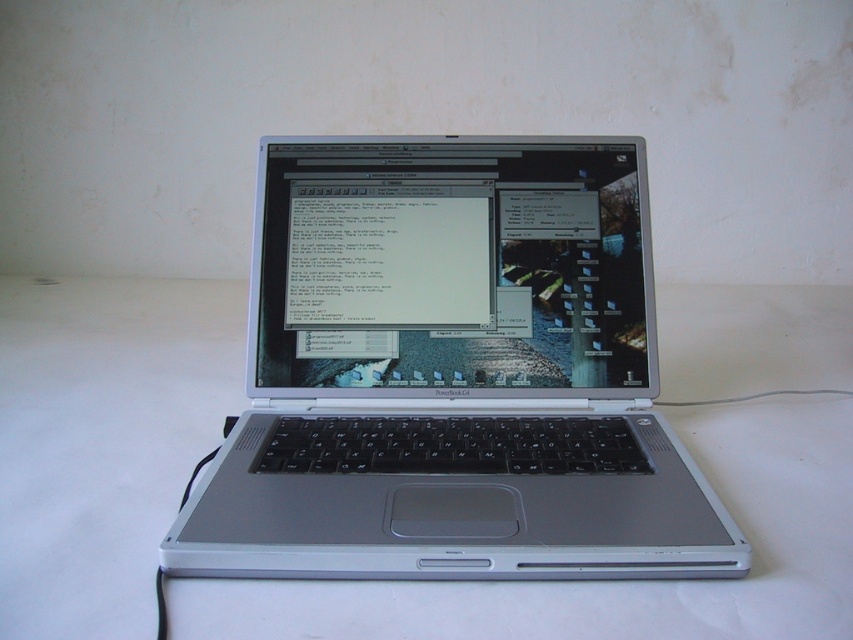
Which of these two, silver metallic laptop at center or white matte table at center, stands taller?

Standing taller between the two is silver metallic laptop at center.

Which is behind, point (676, 547) or point (74, 401)?

Positioned behind is point (74, 401).

Locate an element on the screen. This screenshot has width=853, height=640. silver metallic laptop at center is located at coordinates (451, 372).